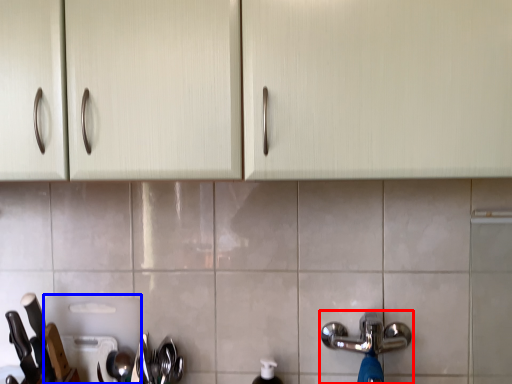
Question: Which object is further to the camera taking this photo, tap (highlighted by a red box) or appliance (highlighted by a blue box)?

Choices:
 (A) tap
 (B) appliance

Answer: (B)